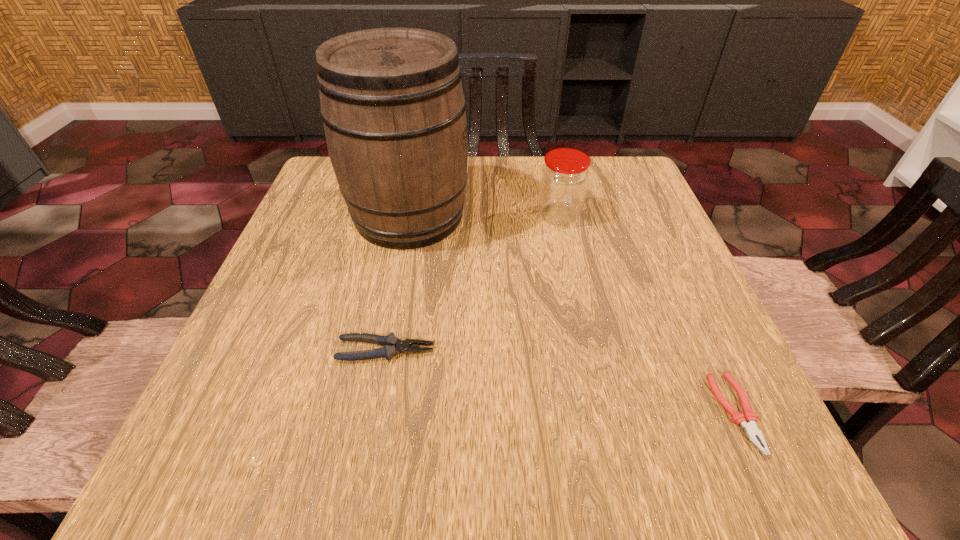
Locate an element on the screen. Image resolution: width=960 pixels, height=540 pixels. vacant space situated 0.330m on the back of the rightmost object is located at coordinates (658, 241).

You are a GUI agent. You are given a task and a screenshot of the screen. Output one action in this format:
    pyautogui.click(x=<x>, y=<y>)
    Task: Click on the wine bucket located in the far edge section of the desktop
    The image size is (960, 540).
    Given the screenshot: What is the action you would take?
    pyautogui.click(x=392, y=104)

Where is `jar positioned at the far edge`? jar positioned at the far edge is located at coordinates (564, 179).

The width and height of the screenshot is (960, 540). Find the location of `object positioned at the near edge`. object positioned at the near edge is located at coordinates (747, 420).

Locate an element on the screen. The image size is (960, 540). object that is at the left edge is located at coordinates (392, 104).

Where is `object situated at the right edge`? object situated at the right edge is located at coordinates (747, 420).

At what (x,y) coordinates should I click in order to perform the action: click on object that is positioned at the far left corner. Please return your answer as a coordinate pair (x, y). Looking at the image, I should click on (392, 104).

Identify the location of object that is at the near right corner. The height and width of the screenshot is (540, 960). (747, 420).

At what (x,y) coordinates should I click in order to perform the action: click on free location at the far edge of the desktop. Please return your answer as a coordinate pair (x, y). Looking at the image, I should click on (586, 206).

I want to click on free space at the near edge of the desktop, so click(435, 462).